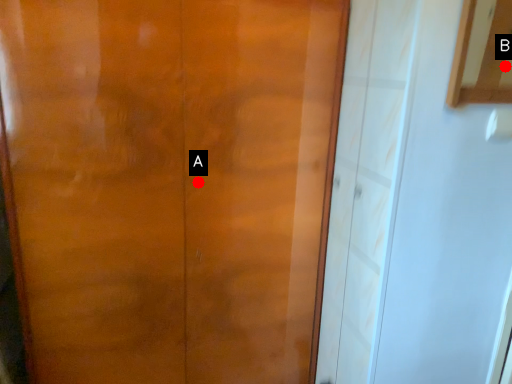
Question: Two points are circled on the image, labeled by A and B beside each circle. Which point is closer to the camera taking this photo?

Choices:
 (A) A is closer
 (B) B is closer

Answer: (A)